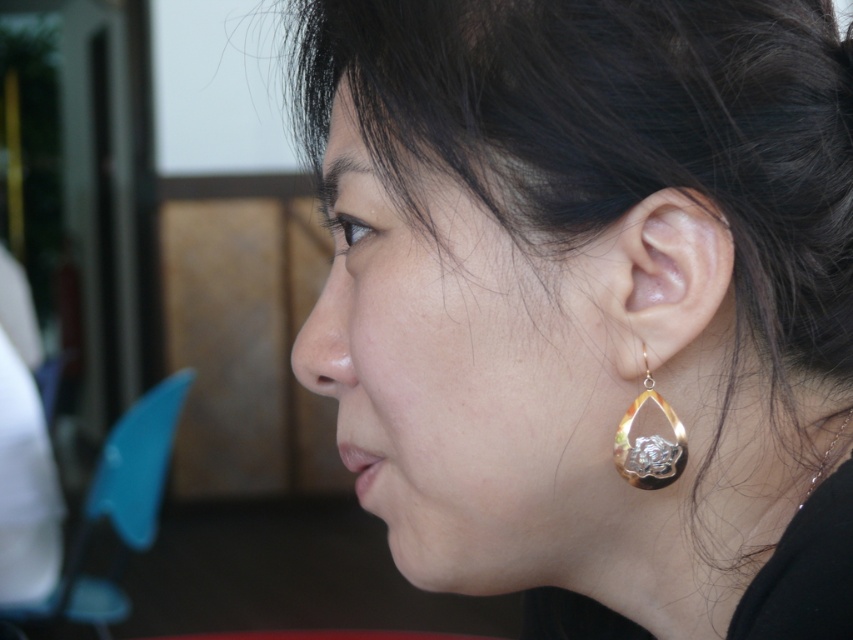
Question: Which point is farther to the camera?

Choices:
 (A) (634, 458)
 (B) (631, 317)

Answer: (A)

Question: Is gold metallic earrings at right bigger than gold/textured earring at right?

Choices:
 (A) yes
 (B) no

Answer: (A)

Question: Which object is closer to the camera taking this photo?

Choices:
 (A) gold metallic earrings at right
 (B) gold/textured metal teardrop-shaped earring at ear

Answer: (A)

Question: Can you confirm if gold/textured earring at right is positioned above gold/textured metal teardrop-shaped earring at ear?

Choices:
 (A) no
 (B) yes

Answer: (B)

Question: In this image, where is gold/textured earring at right located relative to gold/textured metal teardrop-shaped earring at ear?

Choices:
 (A) left
 (B) right

Answer: (B)

Question: Which object is farther from the camera taking this photo?

Choices:
 (A) gold metallic earrings at right
 (B) gold/textured metal teardrop-shaped earring at ear

Answer: (B)